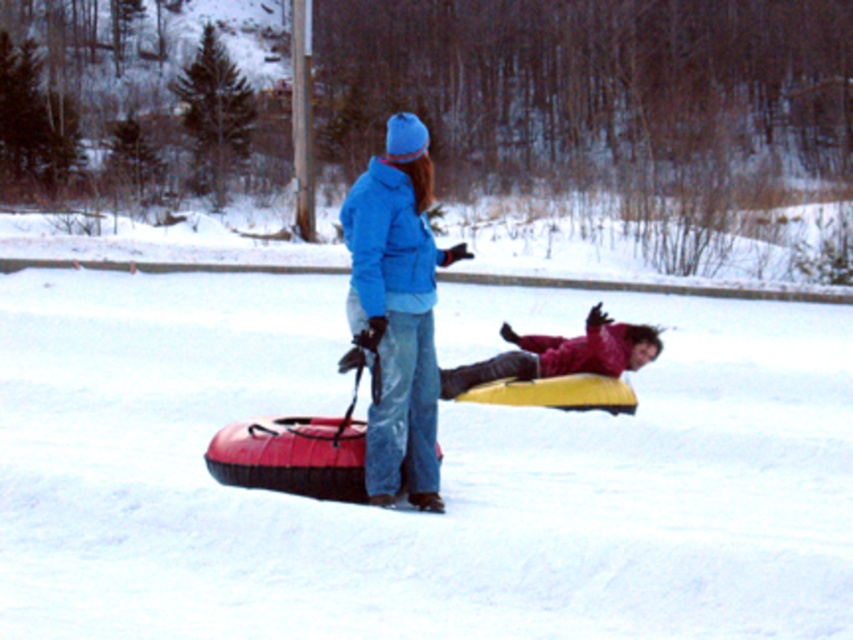
Question: Which point is farther from the camera taking this photo?

Choices:
 (A) (635, 353)
 (B) (15, 432)

Answer: (A)

Question: From the image, what is the correct spatial relationship of white matte snow at center in relation to matte blue jacket at center?

Choices:
 (A) above
 (B) below

Answer: (B)

Question: Which of the following is the closest to the observer?

Choices:
 (A) matte yellow tube at lower right
 (B) white matte snow at center

Answer: (B)

Question: Among these objects, which one is farthest from the camera?

Choices:
 (A) matte blue jacket at center
 (B) white matte snow at center

Answer: (A)

Question: Does matte blue jacket at center have a larger size compared to matte yellow tube at lower right?

Choices:
 (A) no
 (B) yes

Answer: (A)

Question: Is matte blue jacket at center below matte yellow tube at lower right?

Choices:
 (A) yes
 (B) no

Answer: (B)